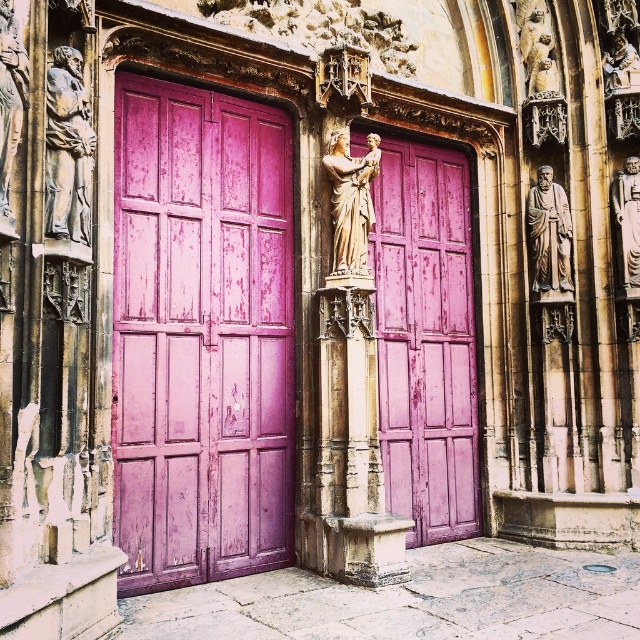
You are standing in front of the double doors. Where is the golden stone statue at upper right located in relation to the doors?

The golden stone statue at upper right is located at point [536,45] relative to the doors.

You are an architect inspecting the entrance of a historical building. You notice the carved stone figure at left and the golden statue at center. Which one is taller?

The golden statue at center is taller than the carved stone figure at left.